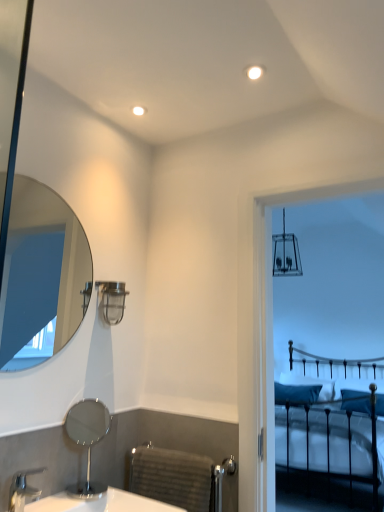
Question: From the image's perspective, is teal fabric pillow at center, the first pillow from the left, positioned above or below blue fabric pillow at right, acting as the first pillow starting from the right?

Choices:
 (A) below
 (B) above

Answer: (A)

Question: Considering the positions of teal fabric pillow at center, the first pillow from the left, and blue fabric pillow at right, acting as the first pillow starting from the right, in the image, is teal fabric pillow at center, the first pillow from the left, wider or thinner than blue fabric pillow at right, acting as the first pillow starting from the right,?

Choices:
 (A) thin
 (B) wide

Answer: (B)

Question: Estimate the real-world distances between objects in this image. Which object is farther from the teal fabric pillow at center, the 2th pillow from the right?

Choices:
 (A) blue fabric pillow at right, acting as the first pillow starting from the right
 (B) black metal bed at upper right
 (C) clear glass mirror at upper left, arranged as the first mirror when viewed from the top
 (D) polished chrome mirror at lower left, placed as the 1th mirror when sorted from bottom to top
 (E) silver metallic faucet at lower left

Answer: (E)

Question: Estimate the real-world distances between objects in this image. Which object is farther from the teal fabric pillow at center, the 2th pillow from the right?

Choices:
 (A) clear glass mirror at upper left, the 2th mirror when ordered from bottom to top
 (B) black metal bed at upper right
 (C) gray textured towel rack at lower center
 (D) silver metallic faucet at lower left
 (E) white glossy sink at lower left

Answer: (D)